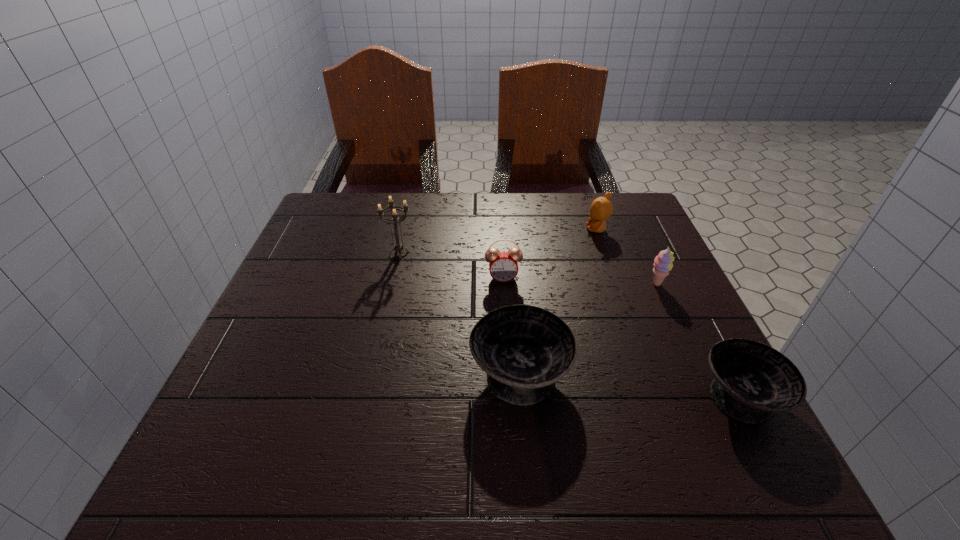
Where is `vacant region located 0.350m on the left of the shorter bowl`? The height and width of the screenshot is (540, 960). vacant region located 0.350m on the left of the shorter bowl is located at coordinates (501, 395).

Where is `vacant space located on the face of the teddy bear`? The height and width of the screenshot is (540, 960). vacant space located on the face of the teddy bear is located at coordinates (484, 230).

Where is `blank space located 0.230m on the face of the teddy bear`? This screenshot has height=540, width=960. blank space located 0.230m on the face of the teddy bear is located at coordinates [x=499, y=230].

Where is `free location located on the face of the teddy bear`? This screenshot has width=960, height=540. free location located on the face of the teddy bear is located at coordinates (564, 230).

Image resolution: width=960 pixels, height=540 pixels. Find the location of `free space located 0.080m on the clock face of the alarm clock`. free space located 0.080m on the clock face of the alarm clock is located at coordinates (505, 308).

Find the location of `vacant area located on the left of the sherbert`. vacant area located on the left of the sherbert is located at coordinates (555, 285).

Locate an element on the screen. free spot located on the right of the fifth nearest object is located at coordinates (491, 254).

Locate an element on the screen. object at the far edge is located at coordinates (601, 208).

Identify the location of bowl that is at the right edge. The width and height of the screenshot is (960, 540). (752, 380).

Identify the location of teddy bear that is positioned at the right edge. The image size is (960, 540). (601, 208).